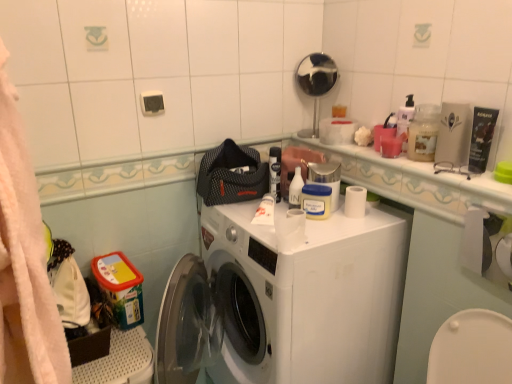
The width and height of the screenshot is (512, 384). I want to click on free spot to the left of matte black tube at upper right, placed as the fifth toiletry when sorted from left to right, so click(426, 168).